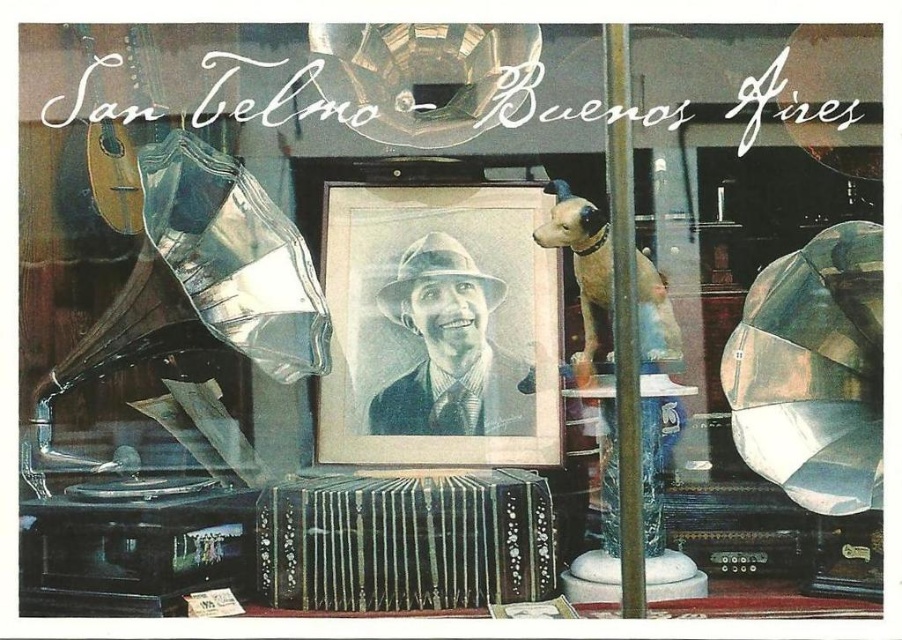
At what (x,y) coordinates should I click in order to perform the action: click on black polished wood accordion at center. Please return your answer as a coordinate pair (x, y). Looking at the image, I should click on (405, 541).

Is black polished wood accordion at center to the right of black paper portrait at center from the viewer's perspective?

Incorrect, black polished wood accordion at center is not on the right side of black paper portrait at center.

In the scene shown: Who is more distant from viewer, (x=286, y=548) or (x=468, y=284)?

Point (x=468, y=284)

Locate an element on the screen. Image resolution: width=902 pixels, height=640 pixels. black polished wood accordion at center is located at coordinates point(405,541).